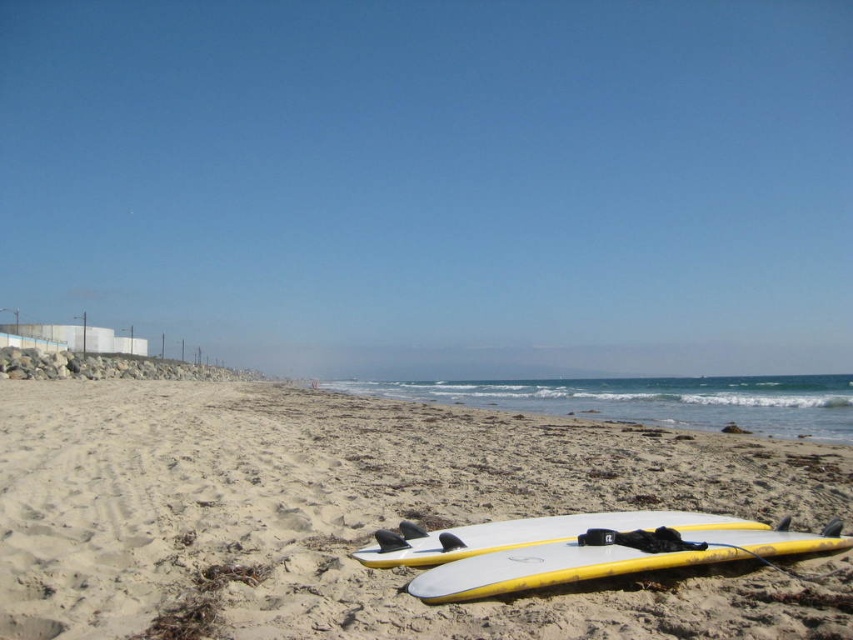
Question: Which object is closer to the camera taking this photo?

Choices:
 (A) yellow matte surfboard at lower center
 (B) white/yellow foam surfboard at lower center

Answer: (A)

Question: Among these points, which one is nearest to the camera?

Choices:
 (A) (379, 584)
 (B) (474, 592)

Answer: (B)

Question: Is white sand at lower center bigger than yellow matte surfboard at lower center?

Choices:
 (A) no
 (B) yes

Answer: (B)

Question: Considering the relative positions of white sand at lower center and yellow matte surfboard at lower center in the image provided, where is white sand at lower center located with respect to yellow matte surfboard at lower center?

Choices:
 (A) right
 (B) left

Answer: (B)

Question: Which point appears farthest from the camera in this image?

Choices:
 (A) (155, 566)
 (B) (709, 544)

Answer: (B)

Question: Is the position of white sand at lower center more distant than that of white/yellow foam surfboard at lower center?

Choices:
 (A) no
 (B) yes

Answer: (A)